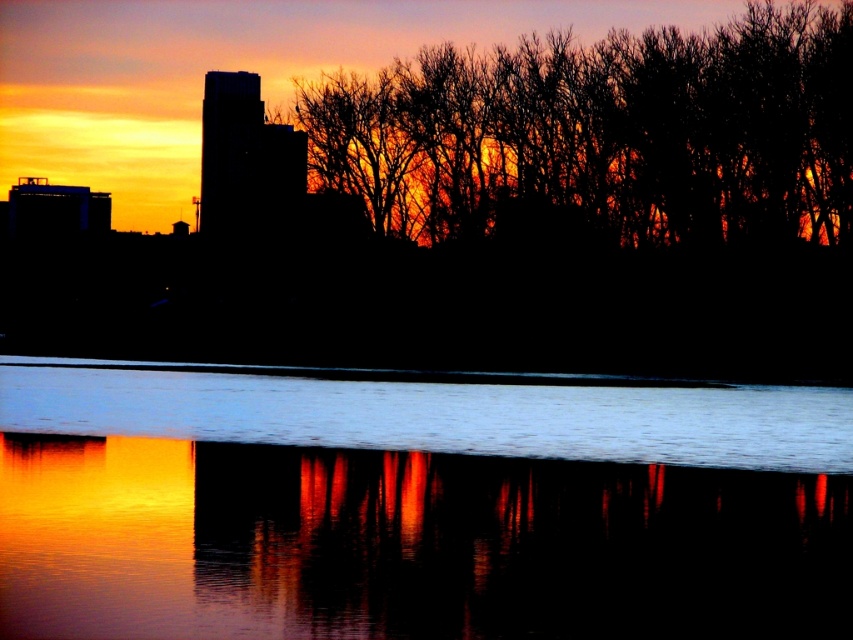
You are standing on a dock and want to take a photo of the smooth glass water at center and the silhouette bare trees at upper center. If your camera can focus on objects up to 70 feet away, will both subjects be in focus?

The smooth glass water at center is 66.39 feet away from silhouette bare trees at upper center. Since the maximum focus distance is 70 feet, both subjects are within range and will be in focus.

You are an artist trying to paint the sunset scene. You need to decide which object to paint first based on their widths. According to the scene, which object should you start with, the smooth glass water at center or the silhouette bare trees at upper center?

The smooth glass water at center has a greater width than the silhouette bare trees at upper center, so you should start with the smooth glass water at center to accommodate its wider area first.

You are a photographer trying to capture the reflection of the silhouette bare trees at upper center in the smooth glass water at center. Based on the scene description, can you confirm if the reflection is visible in the water?

Yes, the smooth glass water at center is located below the silhouette bare trees at upper center, so their reflection should be visible in the water as the water is positioned to mirror the sky and trees above.